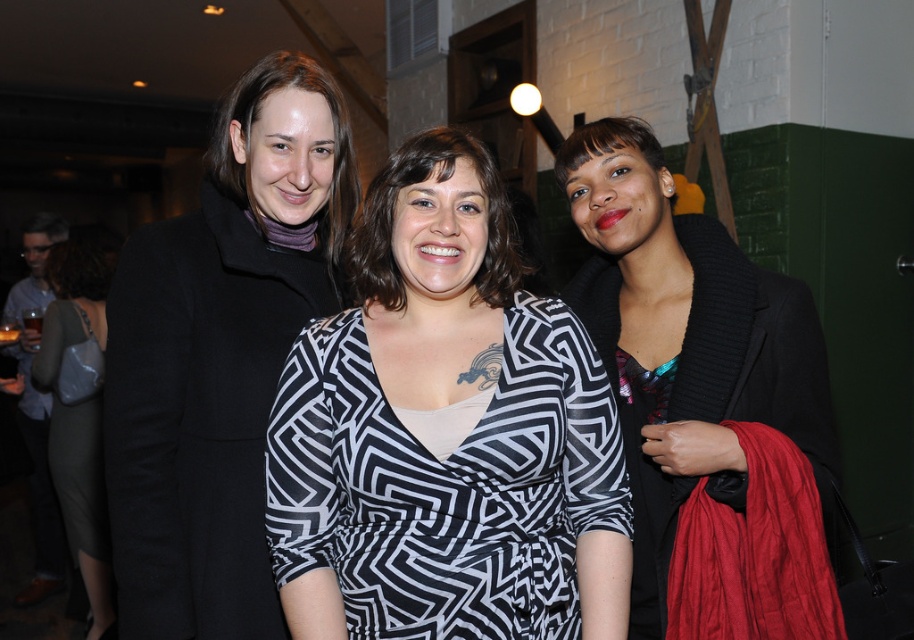
Question: Can you confirm if black and white patterned dress at center is wider than matte gray dress at left?

Choices:
 (A) yes
 (B) no

Answer: (B)

Question: Is black and white patterned dress at center closer to camera compared to black wool coat at left?

Choices:
 (A) yes
 (B) no

Answer: (A)

Question: Is black and white patterned dress at center wider than matte gray dress at left?

Choices:
 (A) yes
 (B) no

Answer: (B)

Question: Which point is farther to the camera?

Choices:
 (A) black wool coat at left
 (B) matte black jacket at left
 (C) black knit sweater at right

Answer: (B)

Question: Which of the following is the closest to the observer?

Choices:
 (A) (569, 577)
 (B) (81, 326)
 (C) (247, 208)

Answer: (A)

Question: Which point is farther to the camera?

Choices:
 (A) matte black jacket at left
 (B) black wool coat at left
 (C) black knit sweater at right
 (D) matte gray dress at left

Answer: (A)